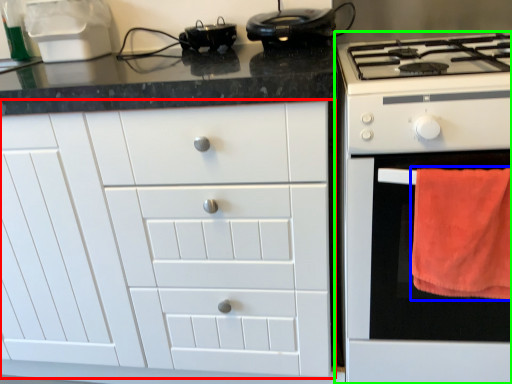
Question: Which object is the farthest from cabinetry (highlighted by a red box)? Choose among these: beach towel (highlighted by a blue box) or home appliance (highlighted by a green box).

Choices:
 (A) beach towel
 (B) home appliance

Answer: (A)